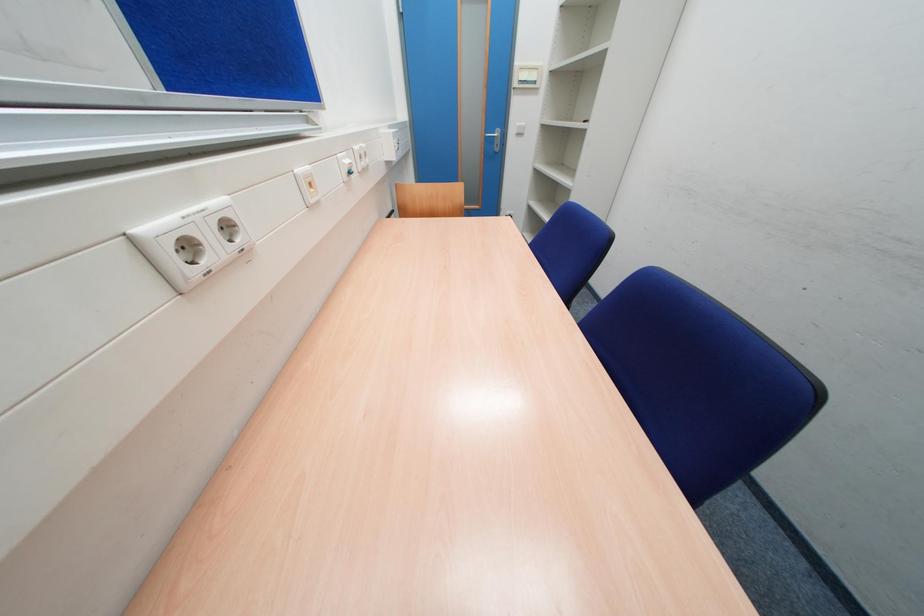
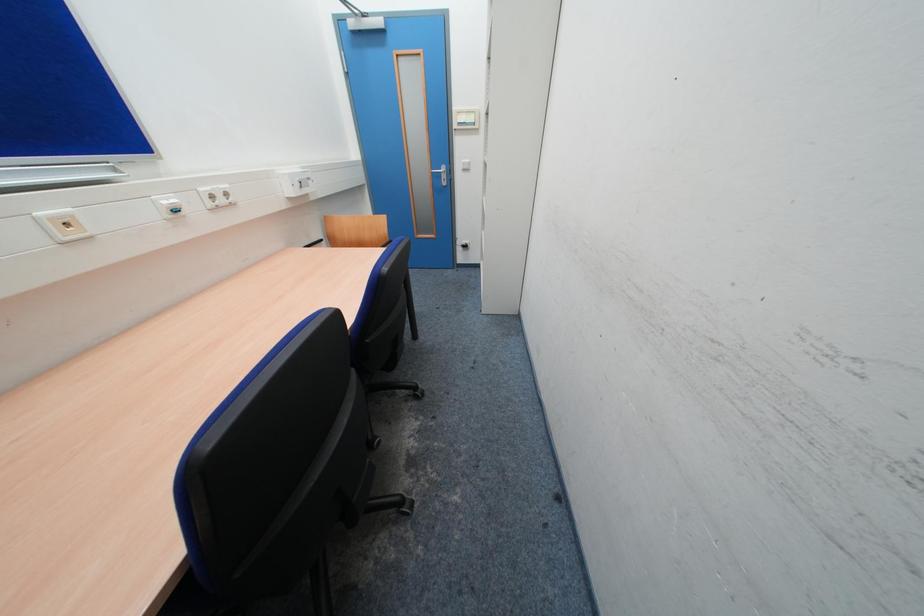
Question: Which direction would the cameraman need to move to produce the second image? Reply with the corresponding letter.

Choices:
 (A) Left
 (B) Right
 (C) Forward
 (D) Backward

Answer: (B)